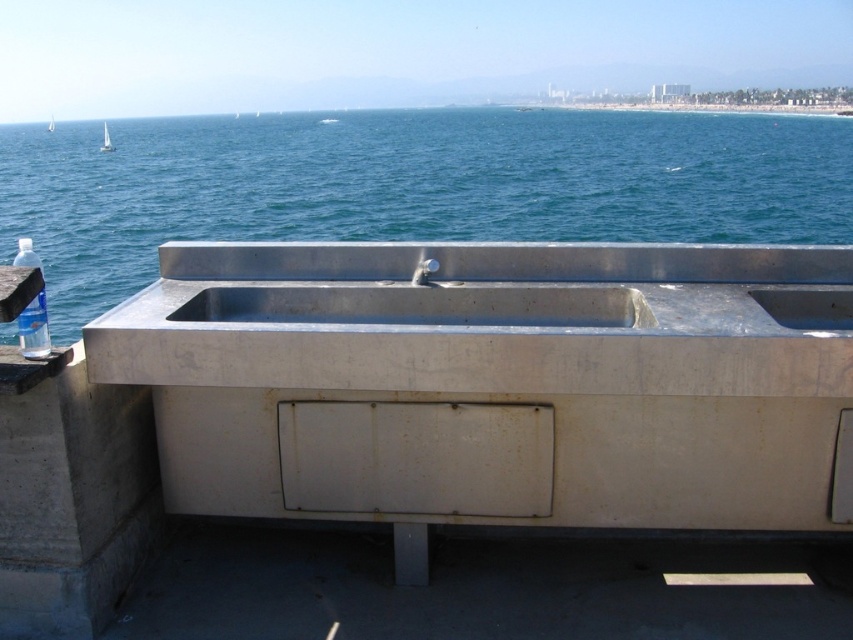
You are an architect designing a new outdoor kitchen and need to place the stainless steel sink at center and the white sailboat at left. Given their sizes, which object should be placed closer to the edge of the kitchen to ensure stability?

The stainless steel sink at center has a smaller size compared to the white sailboat at left. Therefore, the white sailboat at left should be placed closer to the edge of the kitchen to ensure stability since larger objects typically require more secure placement.